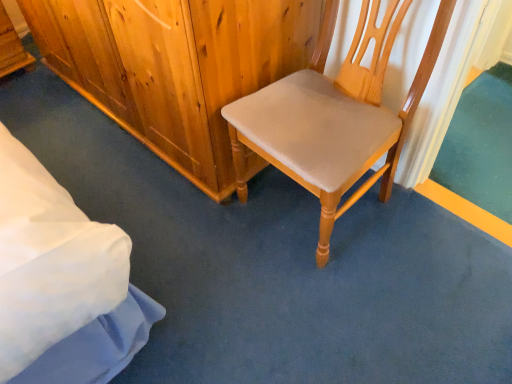
At what (x,y) coordinates should I click in order to perform the action: click on vacant area that lies to the right of light brown wood chair at center. Please return your answer as a coordinate pair (x, y). Image resolution: width=512 pixels, height=384 pixels. Looking at the image, I should click on (435, 235).